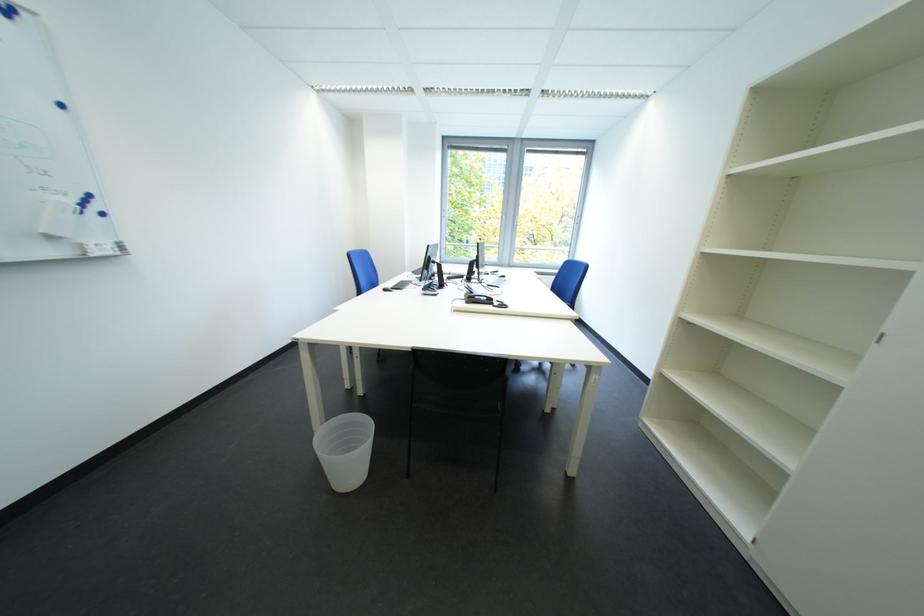
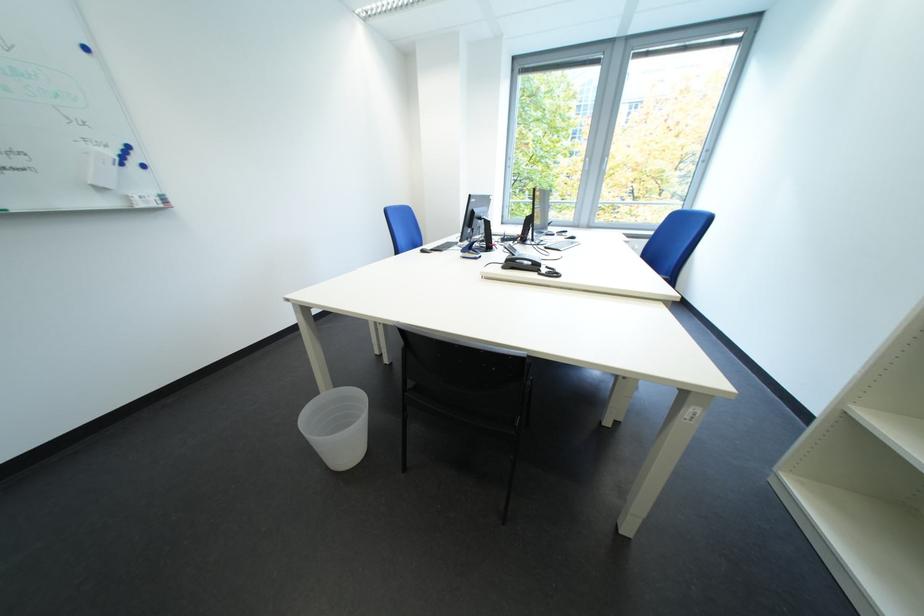
Where in the second image is the point corresponding to point 385,286 from the first image?

(427, 248)